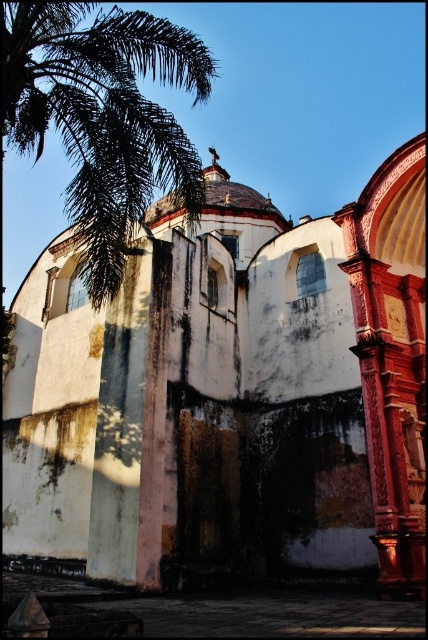
Question: Is white weathered stone church at center positioned before green leafy palm at upper left?

Choices:
 (A) yes
 (B) no

Answer: (A)

Question: Does white weathered stone church at center have a greater width compared to green leafy palm at upper left?

Choices:
 (A) no
 (B) yes

Answer: (A)

Question: Among these objects, which one is nearest to the camera?

Choices:
 (A) green leafy palm at upper left
 (B) white weathered stone church at center

Answer: (B)

Question: Is white weathered stone church at center behind green leafy palm at upper left?

Choices:
 (A) no
 (B) yes

Answer: (A)